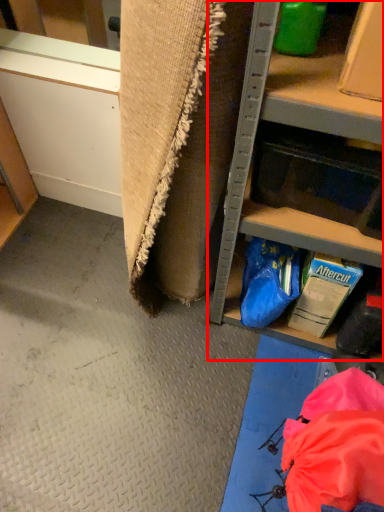
Question: Where is shelf (annotated by the red box) located in relation to drawer in the image?

Choices:
 (A) right
 (B) left

Answer: (A)